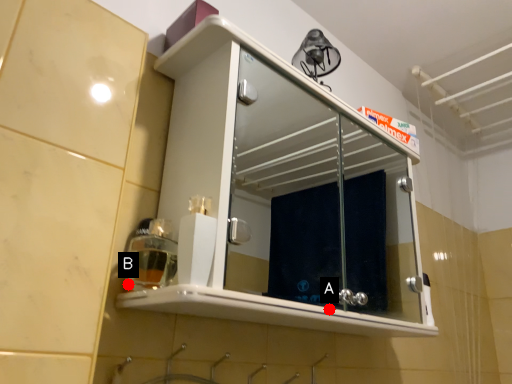
Question: Two points are circled on the image, labeled by A and B beside each circle. Which point is closer to the camera?

Choices:
 (A) A is closer
 (B) B is closer

Answer: (B)